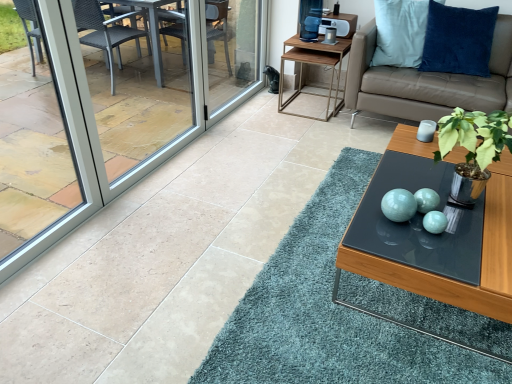
The image size is (512, 384). In order to click on space that is in front of matte turquoise spheres at center in this screenshot , I will do `click(407, 248)`.